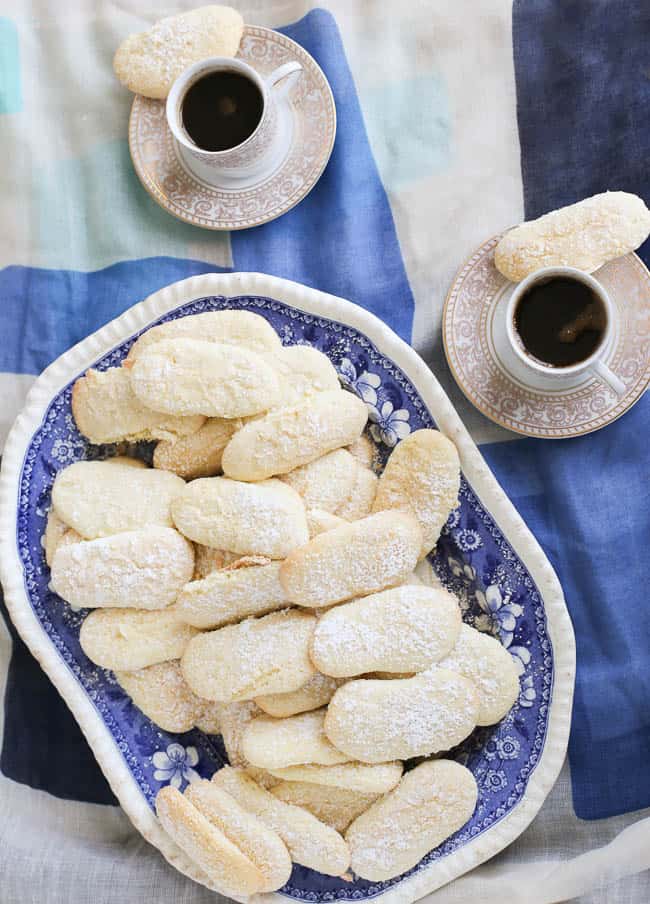
Image resolution: width=650 pixels, height=904 pixels. I want to click on white trim, so click(x=514, y=814).